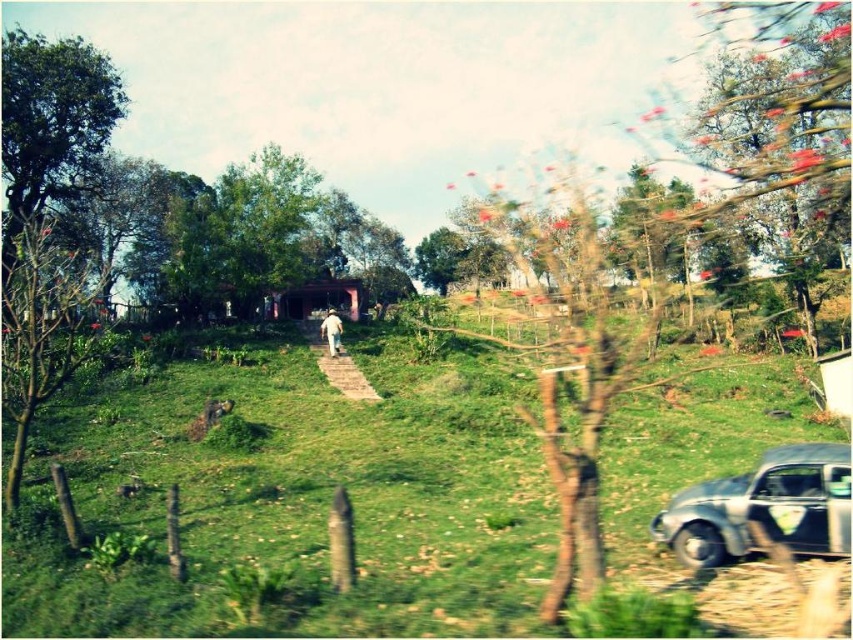
Image resolution: width=853 pixels, height=640 pixels. What do you see at coordinates (763, 508) in the screenshot?
I see `rusty metallic car at lower right` at bounding box center [763, 508].

Consider the image. Which is above, rusty metallic car at lower right or white cotton hat at center?

Positioned higher is white cotton hat at center.

Locate an element on the screen. The image size is (853, 640). rusty metallic car at lower right is located at coordinates (763, 508).

Describe the element at coordinates (291, 504) in the screenshot. I see `green grassy at center` at that location.

Does green grassy at center lie behind green leafy tree at center?

No, it is not.

The image size is (853, 640). In order to click on green grassy at center in this screenshot , I will do `click(291, 504)`.

The width and height of the screenshot is (853, 640). Describe the element at coordinates (781, 122) in the screenshot. I see `pink flowered tree at upper right` at that location.

Is pink flowered tree at upper right wider than rusty metallic car at lower right?

Yes.

Is point (775, 76) more distant than point (808, 472)?

Yes.

The image size is (853, 640). I want to click on pink flowered tree at upper right, so click(x=781, y=122).